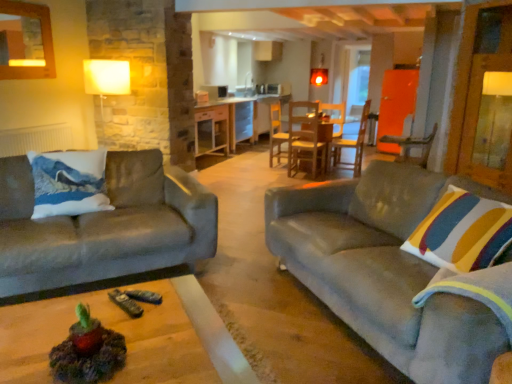
Question: From a real-world perspective, does wooden chair at right, marked as the second chair in a left-to-right arrangement, sit lower than white matte radiator at left?

Choices:
 (A) no
 (B) yes

Answer: (A)

Question: Is wooden chair at right, marked as the second chair in a left-to-right arrangement, wider than white matte radiator at left?

Choices:
 (A) yes
 (B) no

Answer: (A)

Question: Does wooden chair at right, marked as the second chair in a left-to-right arrangement, lie behind white matte radiator at left?

Choices:
 (A) no
 (B) yes

Answer: (A)

Question: From a real-world perspective, does wooden chair at right, acting as the 1th chair starting from the right, stand above white matte radiator at left?

Choices:
 (A) yes
 (B) no

Answer: (A)

Question: Is wooden chair at right, acting as the 1th chair starting from the right, positioned beyond the bounds of white matte radiator at left?

Choices:
 (A) yes
 (B) no

Answer: (A)

Question: In the image, is transparent glass door at center positioned in front of or behind velvet grey couch at right, which ranks as the 2th studio couch in left-to-right order?

Choices:
 (A) behind
 (B) front

Answer: (A)

Question: Visually, is transparent glass door at center positioned to the left or to the right of velvet grey couch at right, acting as the 1th studio couch starting from the right?

Choices:
 (A) right
 (B) left

Answer: (A)

Question: Is transparent glass door at center situated inside velvet grey couch at right, which ranks as the 2th studio couch in left-to-right order, or outside?

Choices:
 (A) outside
 (B) inside

Answer: (A)

Question: From a real-world perspective, is transparent glass door at center physically located above or below velvet grey couch at right, which ranks as the 2th studio couch in left-to-right order?

Choices:
 (A) below
 (B) above

Answer: (B)

Question: Is point (14, 231) closer or farther from the camera than point (406, 137)?

Choices:
 (A) closer
 (B) farther

Answer: (A)

Question: Which is correct: velvet gray couch at left, the 1th studio couch when ordered from left to right, is inside wooden chair at right, the first chair when ordered from front to back, or outside of it?

Choices:
 (A) inside
 (B) outside

Answer: (B)

Question: From a real-world perspective, is velvet gray couch at left, the 1th studio couch when ordered from left to right, physically located above or below wooden chair at right, marked as the second chair in a left-to-right arrangement?

Choices:
 (A) above
 (B) below

Answer: (B)

Question: Is velvet gray couch at left, the 1th studio couch when ordered from left to right, to the left or to the right of wooden chair at right, marked as the second chair in a left-to-right arrangement, in the image?

Choices:
 (A) right
 (B) left

Answer: (B)

Question: From a real-world perspective, relative to wooden chair at center, placed as the first chair when sorted from back to front, is transparent glass door at center vertically above or below?

Choices:
 (A) above
 (B) below

Answer: (A)

Question: Considering their positions, is transparent glass door at center located in front of or behind wooden chair at center, arranged as the 2th chair when viewed from the right?

Choices:
 (A) behind
 (B) front

Answer: (A)